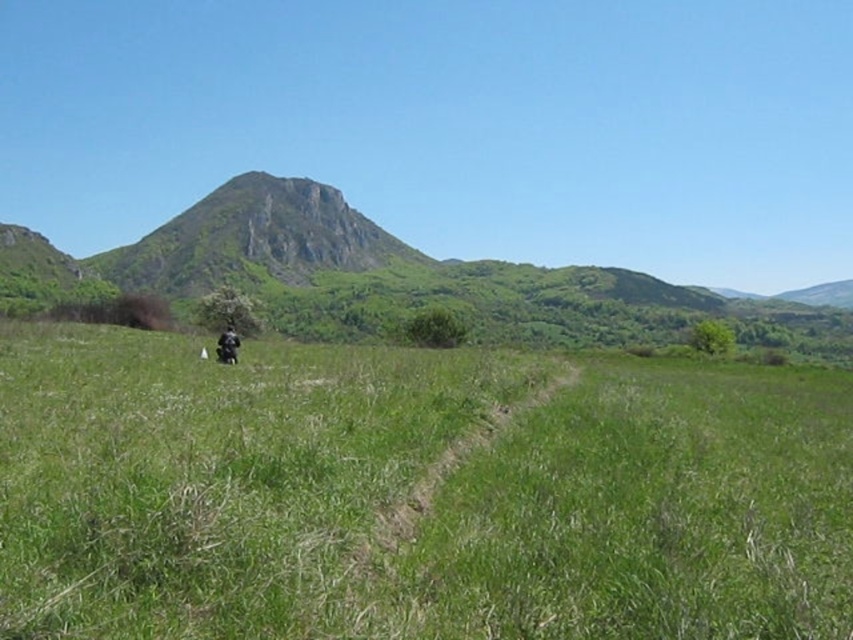
Between green grassy field at center and black matte motorcycle at center, which one has less height?

Standing shorter between the two is black matte motorcycle at center.

Consider the image. Can you confirm if green grassy field at center is shorter than black matte motorcycle at center?

In fact, green grassy field at center may be taller than black matte motorcycle at center.

Identify the location of green grassy field at center. This screenshot has height=640, width=853. (415, 490).